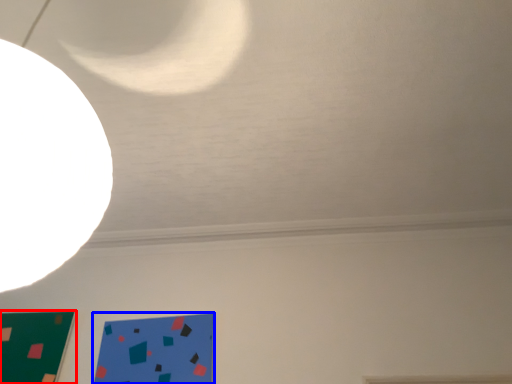
Question: Which object appears farthest to the camera in this image, rectangle (highlighted by a red box) or design (highlighted by a blue box)?

Choices:
 (A) rectangle
 (B) design

Answer: (A)